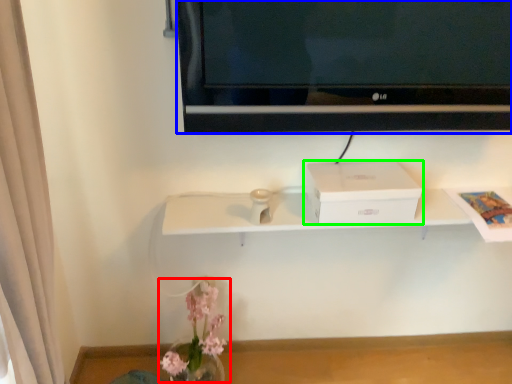
Question: Which object is positioned closest to floral arrangement (highlighted by a red box)? Select from television (highlighted by a blue box) and box (highlighted by a green box).

Choices:
 (A) television
 (B) box

Answer: (B)